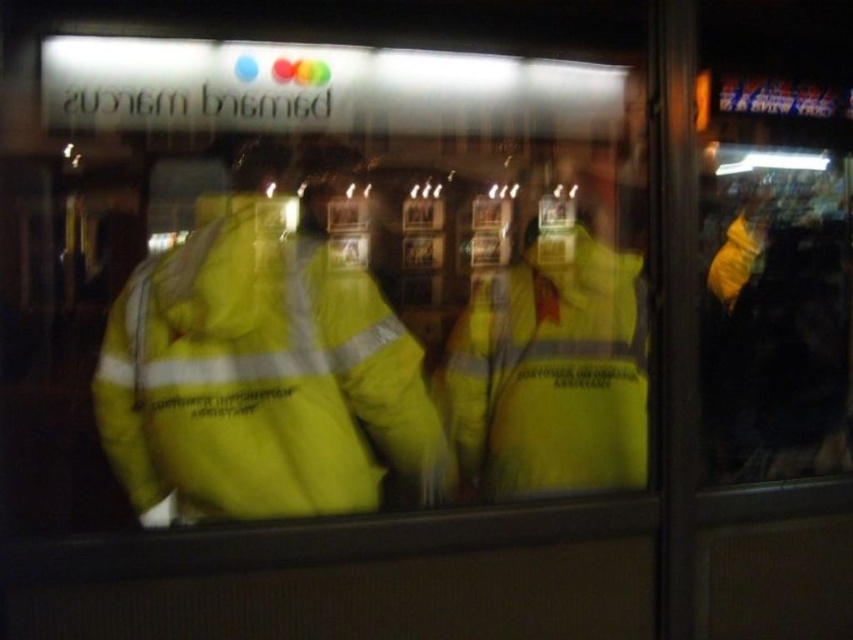
Question: Is high-visibility yellow jacket at center above high-visibility yellow safety vest at center?

Choices:
 (A) no
 (B) yes

Answer: (A)

Question: Which point is closer to the camera taking this photo?

Choices:
 (A) (543, 481)
 (B) (171, 269)

Answer: (B)

Question: Does high-visibility yellow jacket at center have a larger size compared to high-visibility yellow safety vest at center?

Choices:
 (A) no
 (B) yes

Answer: (B)

Question: Does high-visibility yellow jacket at center have a larger size compared to high-visibility yellow safety vest at center?

Choices:
 (A) no
 (B) yes

Answer: (B)

Question: Which point appears farthest from the camera in this image?

Choices:
 (A) (532, 305)
 (B) (256, 339)

Answer: (A)